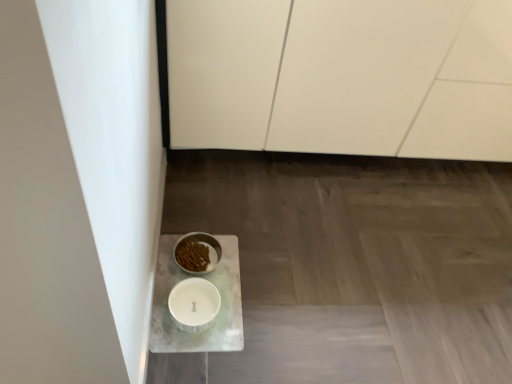
Question: Is white marble tray at lower left inside or outside of white matte cabinet at upper center?

Choices:
 (A) outside
 (B) inside

Answer: (A)

Question: From a real-world perspective, is white marble tray at lower left above or below white matte cabinet at upper center?

Choices:
 (A) above
 (B) below

Answer: (B)

Question: Considering the real-world distances, which object is closest to the white marble tray at lower left?

Choices:
 (A) white glossy bowl at lower left, arranged as the first tableware when ordered from the bottom
 (B) white matte cabinet at upper center
 (C) white marble tray at lower left
 (D) white glossy bowl at lower left, arranged as the first tableware when viewed from the top

Answer: (C)

Question: Which of these objects is positioned closest to the white marble tray at lower left?

Choices:
 (A) white marble tray at lower left
 (B) white matte cabinet at upper center
 (C) white glossy bowl at lower left, arranged as the first tableware when viewed from the top
 (D) white glossy bowl at lower left, arranged as the first tableware when ordered from the bottom

Answer: (D)